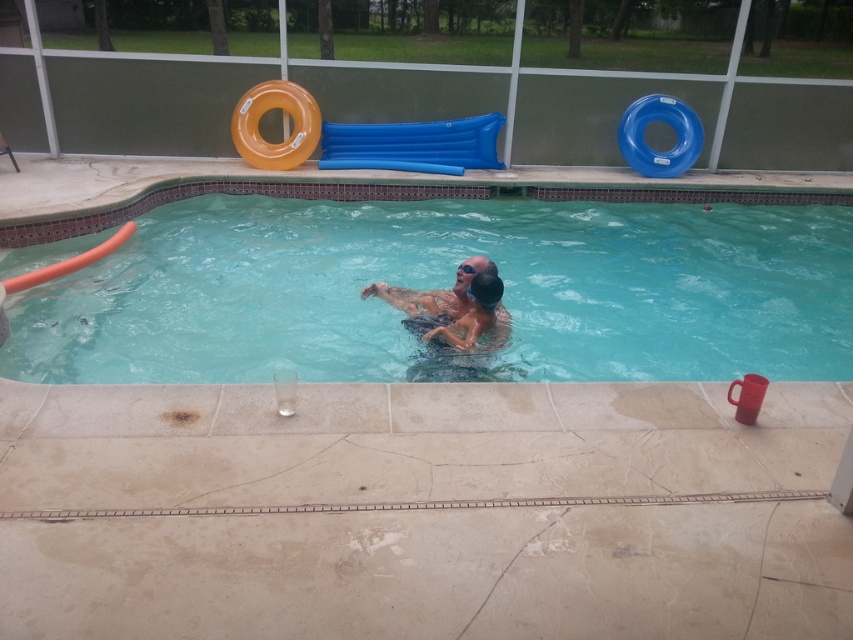
Question: Does matte black swim cap at center have a greater width compared to orange rubber slide at upper left?

Choices:
 (A) no
 (B) yes

Answer: (B)

Question: Which object is positioned closest to the blue inflatable slide at upper center?

Choices:
 (A) orange rubber slide at upper left
 (B) clear plastic goggles at upper center
 (C) clear plastic pool at center

Answer: (C)

Question: Which is nearer to the clear plastic pool at center?

Choices:
 (A) clear plastic goggles at upper center
 (B) orange rubber slide at upper left

Answer: (B)

Question: Is orange rubber slide at upper left above clear plastic goggles at upper center?

Choices:
 (A) no
 (B) yes

Answer: (B)

Question: Does matte black swim cap at center lie behind black rubber swim cap at center?

Choices:
 (A) no
 (B) yes

Answer: (B)

Question: Which is farther from the matte black swim cap at center?

Choices:
 (A) clear plastic pool at center
 (B) blue inflatable slide at upper center

Answer: (B)